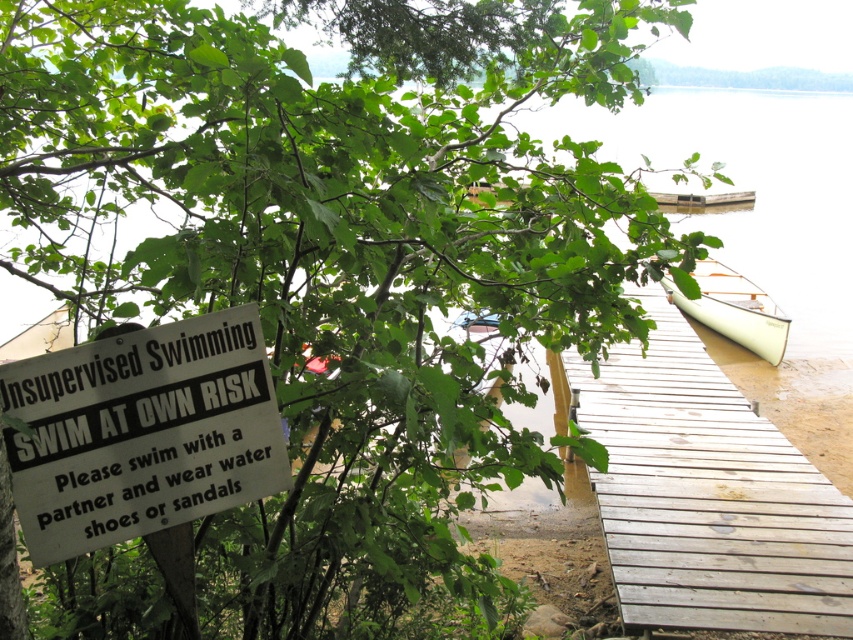
What object is located at the coordinates point (706, 493)?

The wooden dock at center is located at point (706, 493).

You are planning to swim in the lake and see the wooden dock at center and the white paper sign at left. According to the sign, what should you do before entering the water?

The white paper sign at left advises to swim with a partner and wear water shoes before entering the water.

What is the 2D coordinate of the clear water at center?

The clear water at center is located at the 2D coordinate point of (x=747, y=188).